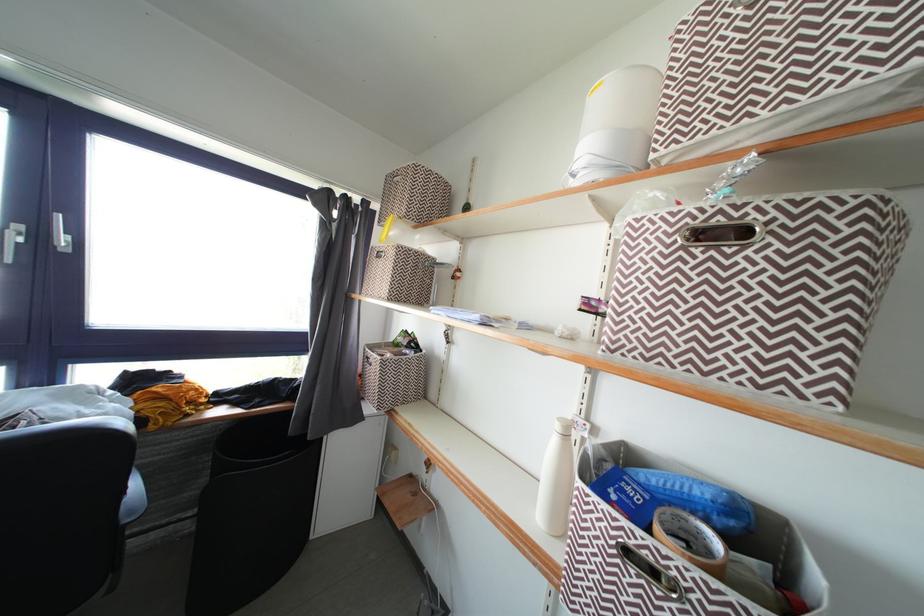
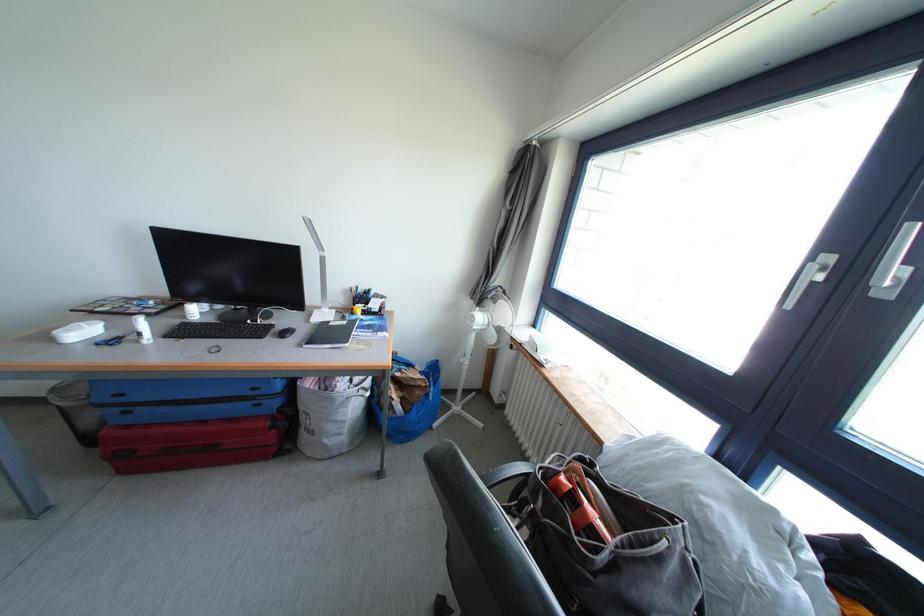
Question: Based on the continuous images, in which direction is the camera rotating? Reply with the corresponding letter.

Choices:
 (A) Left
 (B) Right
 (C) Up
 (D) Down

Answer: (A)